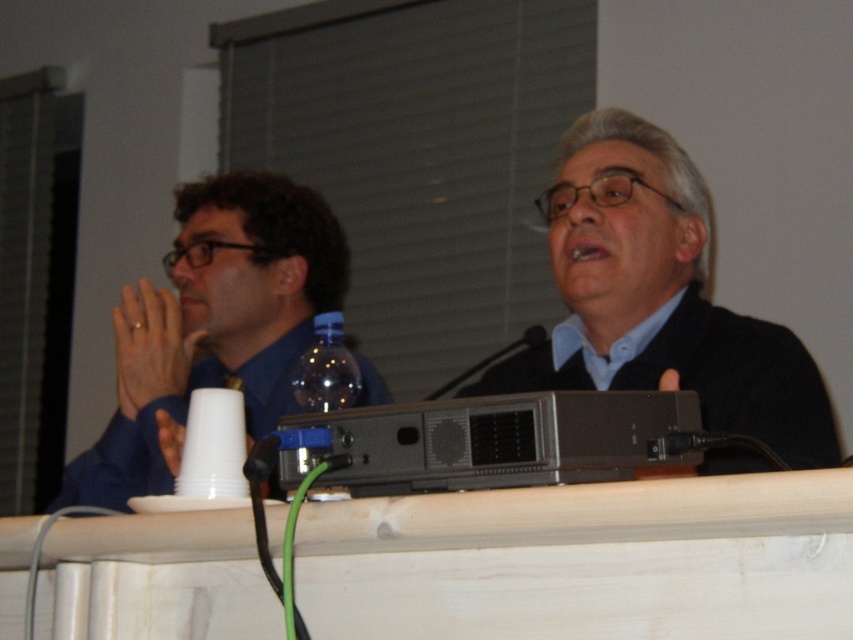
You are a sound technician adjusting the audio equipment. You notice the black matte suit at center and the black plastic microphone at center on the table. Which object is directly covering the other?

The black matte suit at center is positioned over the black plastic microphone at center, so it is directly covering it.

You are standing in front of the table where two people are seated. There are two points marked on the table. The first point is at coordinates point (595,253) and the second point is at point (469,369). Which of these points is closer to you?

Point (595,253) is closer to the viewer than point (469,369).